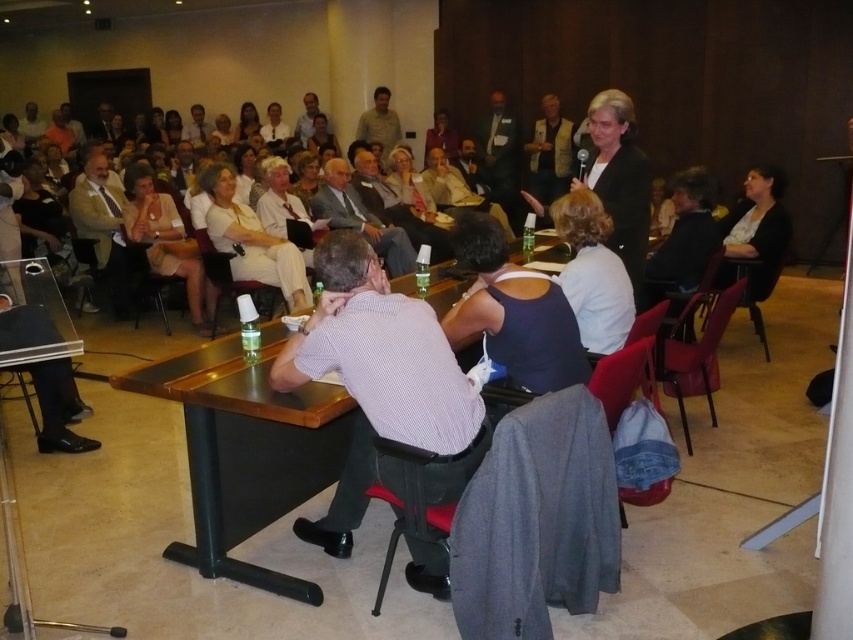
You are standing in the conference room and want to place a small object on the table. You have two points on the table where you can place it. Which point is closer to you, point (x=525, y=298) or point (x=136, y=230)?

Point (x=525, y=298) is closer to the viewer than point (x=136, y=230), so you should place the object there.